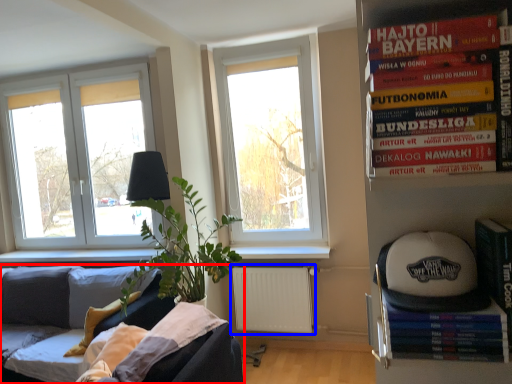
Question: Which object is further to the camera taking this photo, studio couch (highlighted by a red box) or radiator (highlighted by a blue box)?

Choices:
 (A) studio couch
 (B) radiator

Answer: (B)